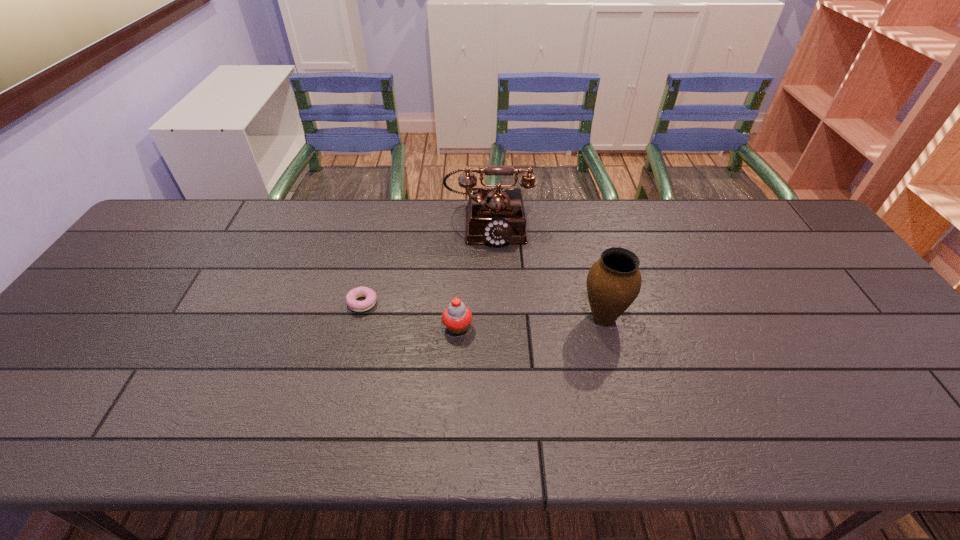
At what (x,y) coordinates should I click in order to perform the action: click on vacant area that satisfies the following two spatial constraints: 1. on the front side of the leftmost object; 2. on the right side of the cupcake. Please return your answer as a coordinate pair (x, y). Looking at the image, I should click on (356, 327).